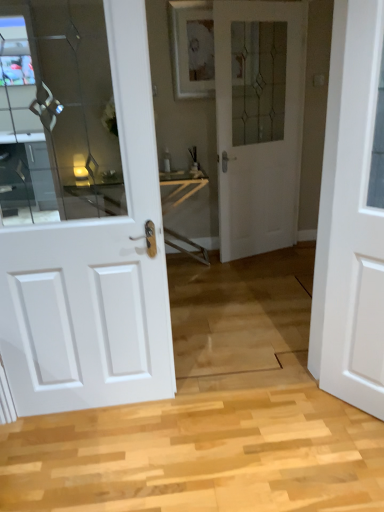
Question: Relative to white matte door at right, marked as the first door in a right-to-left arrangement, is white glass door at center, the second door in the right-to-left sequence, in front or behind?

Choices:
 (A) front
 (B) behind

Answer: (B)

Question: Considering the positions of white glass door at center, the second door in the right-to-left sequence, and white matte door at right, marked as the first door in a right-to-left arrangement, in the image, is white glass door at center, the second door in the right-to-left sequence, wider or thinner than white matte door at right, marked as the first door in a right-to-left arrangement,?

Choices:
 (A) thin
 (B) wide

Answer: (A)

Question: Which of these objects is positioned farthest from the white matte door at right, marked as the third door in a back-to-front arrangement?

Choices:
 (A) white glass door at center, which ranks as the 2th door in left-to-right order
 (B) white glossy door at left, the first door viewed from the left

Answer: (A)

Question: Based on their relative distances, which object is farther from the white glass door at center, the 1th door when ordered from back to front?

Choices:
 (A) white glossy door at left, placed as the 2th door when sorted from back to front
 (B) white matte door at right, marked as the first door in a right-to-left arrangement

Answer: (A)